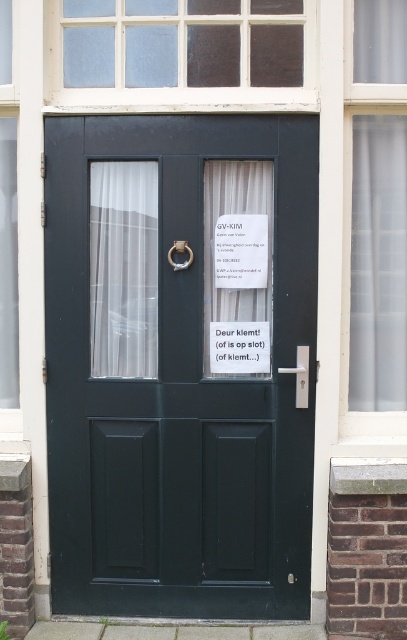
Which is in front, point (231, 202) or point (253, 340)?

Point (253, 340) is more forward.

Between point (212, 195) and point (216, 342), which one is positioned in front?

Point (212, 195) is more forward.

Locate an element on the screen. This screenshot has height=640, width=407. white sheer curtain at center is located at coordinates (212, 241).

Which is behind, point (347, 24) or point (216, 330)?

Positioned behind is point (216, 330).

Does translucent glass window at center have a greater width compared to white paper at center?

Indeed, translucent glass window at center has a greater width compared to white paper at center.

I want to click on translucent glass window at center, so click(374, 224).

Measure the distance between white sheer curtain at left and white sheer curtain at center.

white sheer curtain at left and white sheer curtain at center are 11.72 inches apart.

Between point (111, 182) and point (205, 214), which one is positioned behind?

The point (111, 182) is more distant.

This screenshot has height=640, width=407. What do you see at coordinates (124, 268) in the screenshot?
I see `white sheer curtain at left` at bounding box center [124, 268].

Image resolution: width=407 pixels, height=640 pixels. I want to click on white sheer curtain at left, so click(x=124, y=268).